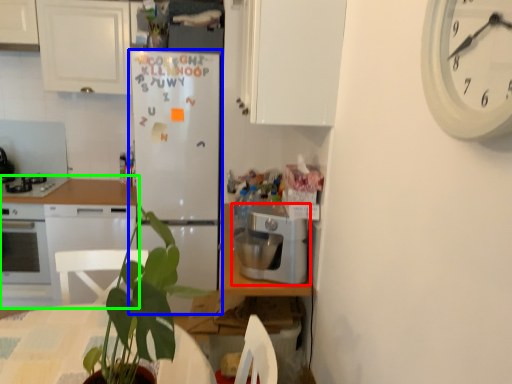
Question: Considering the real-world distances, which object is farthest from kitchen appliance (highlighted by a red box)? refrigerator (highlighted by a blue box) or countertop (highlighted by a green box)?

Choices:
 (A) refrigerator
 (B) countertop

Answer: (B)